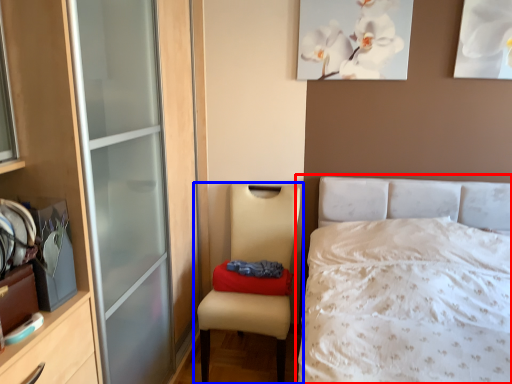
Question: Which of the following is the closest to the observer, bed (highlighted by a red box) or chair (highlighted by a blue box)?

Choices:
 (A) bed
 (B) chair

Answer: (A)